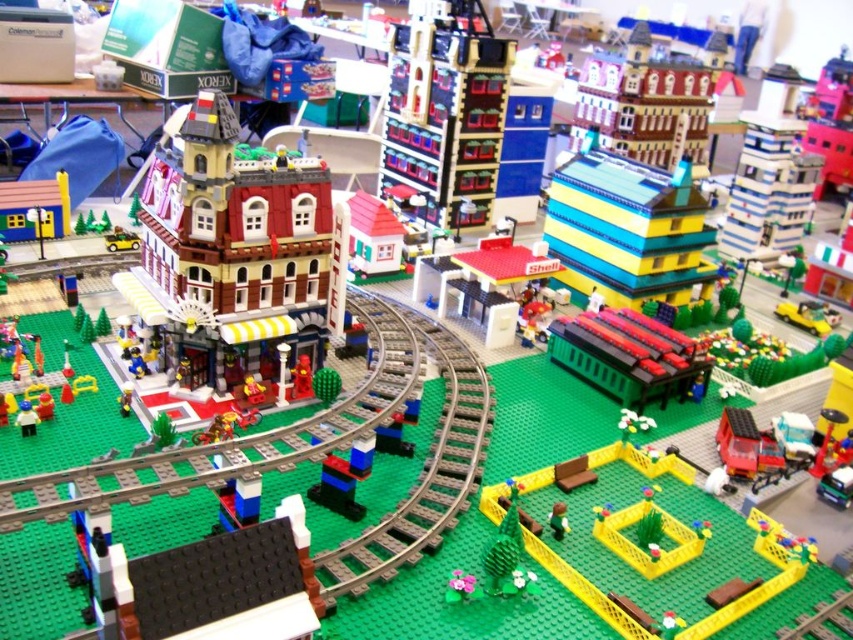
Which is in front, point (639, 292) or point (618, 612)?

Point (618, 612) is more forward.

Does point (704, 214) come closer to viewer compared to point (579, 582)?

No, it is not.

The image size is (853, 640). I want to click on yellow matte building at center, so [628, 230].

In the scene shown: Is matte brown building at upper center positioned at the back of yellow plastic fence at lower center?

Yes, it is behind yellow plastic fence at lower center.

Which is behind, point (711, 36) or point (668, 524)?

The point (711, 36) is behind.

Which is behind, point (589, 122) or point (650, 568)?

The point (589, 122) is more distant.

This screenshot has height=640, width=853. I want to click on matte brown building at upper center, so click(647, 100).

Between green plastic train at center-right and yellow plastic fence at lower center, which one has less height?

yellow plastic fence at lower center is shorter.

Is point (631, 364) positioned in front of point (647, 563)?

No, it is not.

Is point (671, 332) closer to camera compared to point (637, 518)?

That is False.

Find the location of a particular element. The height and width of the screenshot is (640, 853). green plastic train at center-right is located at coordinates (627, 355).